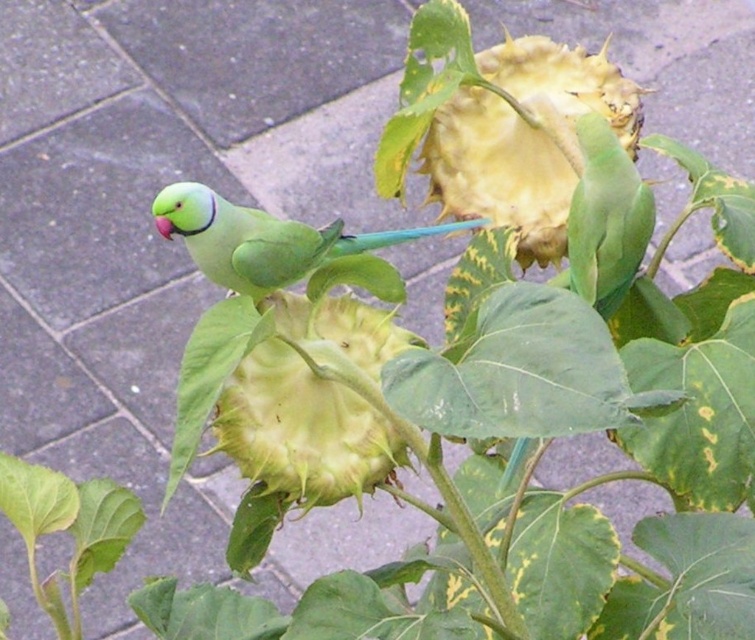
Is point (566, 106) positioned behind point (333, 250)?

Yes, point (566, 106) is farther from viewer.

You are a GUI agent. You are given a task and a screenshot of the screen. Output one action in this format:
    pyautogui.click(x=<x>, y=<y>)
    Task: Click on the yellowish-green textured sunflower at center
    
    Given the screenshot: What is the action you would take?
    pyautogui.click(x=525, y=138)

Between point (532, 157) and point (304, 312), which one is positioned in front?

Point (304, 312)

Can you confirm if yellowish-green textured sunflower at center is shorter than green matte sunflower at center?

No, yellowish-green textured sunflower at center is not shorter than green matte sunflower at center.

What do you see at coordinates (525, 138) in the screenshot?
I see `yellowish-green textured sunflower at center` at bounding box center [525, 138].

Locate an element on the screen. Image resolution: width=755 pixels, height=640 pixels. yellowish-green textured sunflower at center is located at coordinates (525, 138).

Is yellowish-green textured sunflower at center to the left of green matte parrot at upper right from the viewer's perspective?

Indeed, yellowish-green textured sunflower at center is positioned on the left side of green matte parrot at upper right.

Who is taller, yellowish-green textured sunflower at center or green matte parrot at upper right?

With more height is yellowish-green textured sunflower at center.

Who is more forward, (550, 180) or (630, 260)?

Positioned in front is point (630, 260).

This screenshot has height=640, width=755. I want to click on yellowish-green textured sunflower at center, so click(525, 138).